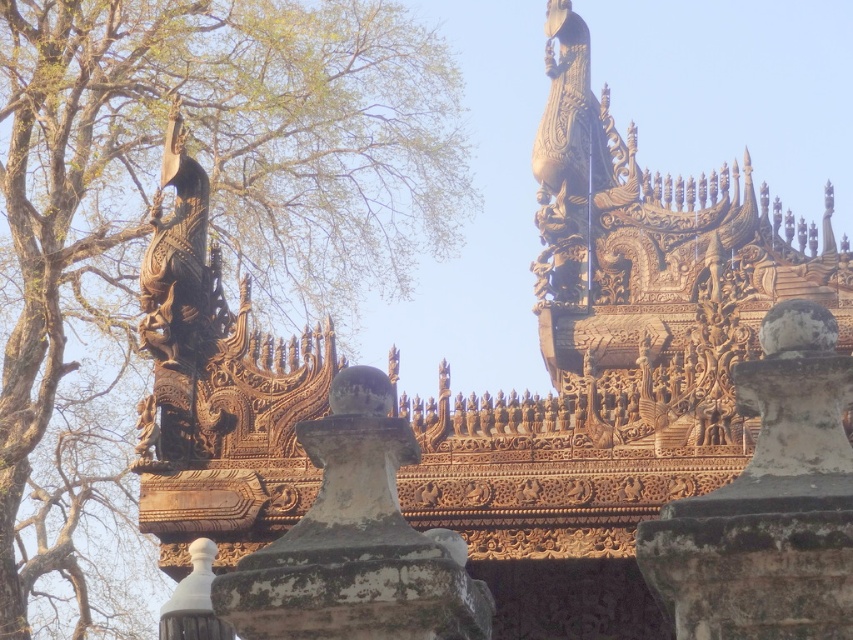
At what (x,y) coordinates should I click in order to perform the action: click on white stone pillar at center. Please return your answer as a coordinate pair (x, y). Image resolution: width=853 pixels, height=640 pixels. Looking at the image, I should click on (769, 500).

What do you see at coordinates (769, 500) in the screenshot? I see `white stone pillar at center` at bounding box center [769, 500].

Find the location of a particular element. The image size is (853, 640). white stone pillar at center is located at coordinates (769, 500).

Does point (59, 566) come closer to viewer compared to point (349, 380)?

No, (59, 566) is behind (349, 380).

Which is in front, point (403, 282) or point (281, 637)?

Point (281, 637) is in front.

The width and height of the screenshot is (853, 640). What are the coordinates of `green leafy tree at upper left` in the screenshot? It's located at (212, 193).

Consider the image. Can you confirm if green leafy tree at upper left is smaller than white stone pillar at center?

Incorrect, green leafy tree at upper left is not smaller in size than white stone pillar at center.

Who is higher up, green leafy tree at upper left or white stone pillar at center?

green leafy tree at upper left

Measure the distance between point (32, 198) and camera.

Point (32, 198) is 138.15 meters from camera.

Locate an element on the screen. This screenshot has width=853, height=640. green leafy tree at upper left is located at coordinates (212, 193).